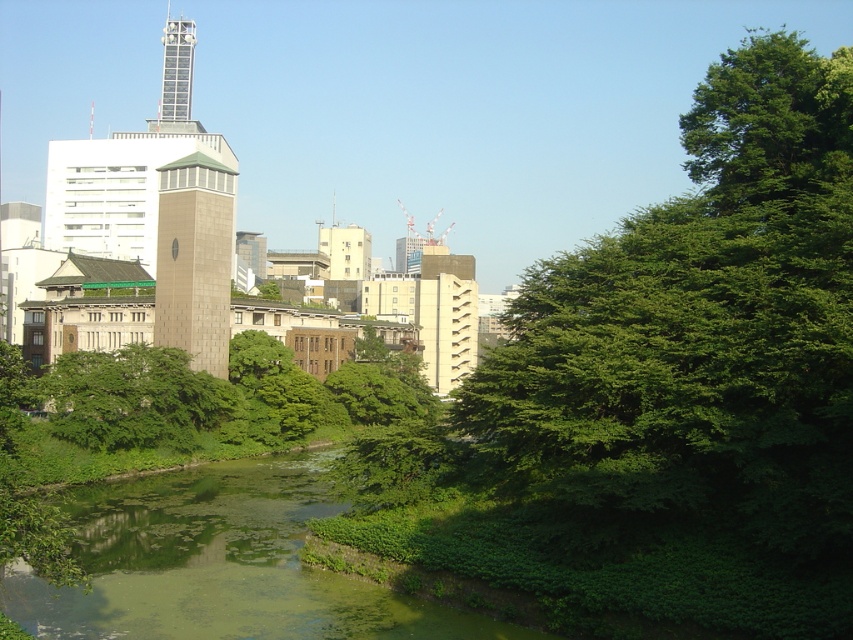
Does point (141, 637) come closer to viewer compared to point (155, 294)?

Yes, point (141, 637) is closer to viewer.

Can you confirm if green algae-covered water at lower center is wider than beige textured tower at center?

Indeed, green algae-covered water at lower center has a greater width compared to beige textured tower at center.

Is point (175, 595) positioned in front of point (228, 230)?

Yes, point (175, 595) is closer to viewer.

Where is `green algae-covered water at lower center`? The height and width of the screenshot is (640, 853). green algae-covered water at lower center is located at coordinates (218, 564).

Is beige textured tower at center above metallic silver tower at upper center?

Incorrect, beige textured tower at center is not positioned above metallic silver tower at upper center.

Is beige textured tower at center wider than metallic silver tower at upper center?

In fact, beige textured tower at center might be narrower than metallic silver tower at upper center.

What are the coordinates of `beige textured tower at center` in the screenshot? It's located at (194, 259).

Is green algae-covered water at lower center wider than green leafy tree at center?

Yes.

Is point (437, 637) farther from camera compared to point (165, 364)?

That is False.

You are a GUI agent. You are given a task and a screenshot of the screen. Output one action in this format:
    pyautogui.click(x=<x>, y=<y>)
    Task: Click on the green algae-covered water at lower center
    
    Given the screenshot: What is the action you would take?
    [218, 564]

At what (x,y) coordinates should I click in order to perform the action: click on green algae-covered water at lower center. Please return your answer as a coordinate pair (x, y). The height and width of the screenshot is (640, 853). Looking at the image, I should click on (218, 564).